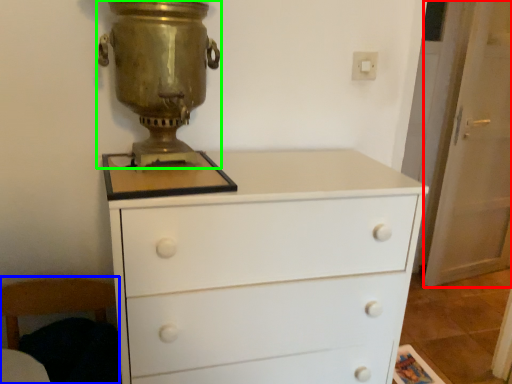
Question: Considering the real-world distances, which object is closest to screen door (highlighted by a red box)? armchair (highlighted by a blue box) or candle holder (highlighted by a green box).

Choices:
 (A) armchair
 (B) candle holder

Answer: (B)